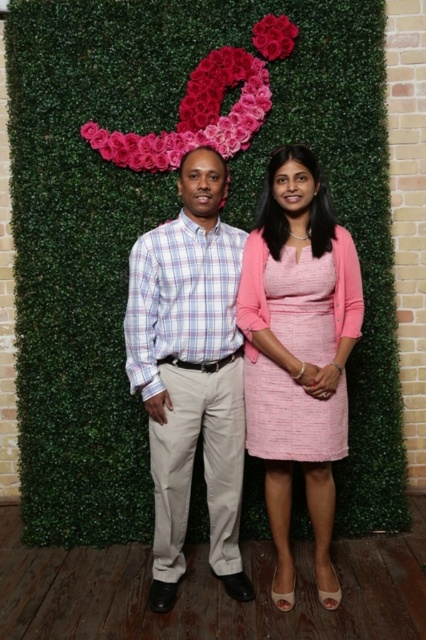
Is pink textured dress at center to the right of pink floral decoration at upper center from the viewer's perspective?

Yes, pink textured dress at center is to the right of pink floral decoration at upper center.

Is point (334, 253) closer to camera compared to point (268, 81)?

That is True.

The height and width of the screenshot is (640, 426). In order to click on pink textured dress at center in this screenshot , I will do `click(299, 353)`.

Between plaid cotton shirt at center and pink textured dress at center, which one is positioned higher?

Positioned higher is pink textured dress at center.

Does plaid cotton shirt at center have a greater width compared to pink textured dress at center?

Yes.

Between point (181, 557) and point (265, 484), which one is positioned in front?

Point (265, 484) is more forward.

The image size is (426, 640). Find the location of `plaid cotton shirt at center`. plaid cotton shirt at center is located at coordinates [190, 372].

Who is positioned more to the right, pink textured dress at center or smooth pink roses at upper center?

Positioned to the right is pink textured dress at center.

The height and width of the screenshot is (640, 426). Identify the location of pink textured dress at center. (299, 353).

Find the location of a particular element. This screenshot has height=640, width=426. pink textured dress at center is located at coordinates (299, 353).